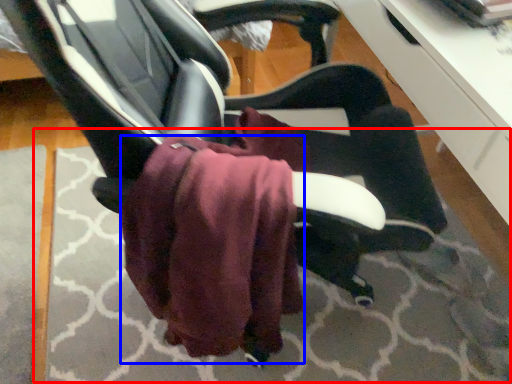
Question: Which object is further to the camera taking this photo, mat (highlighted by a red box) or bath towel (highlighted by a blue box)?

Choices:
 (A) mat
 (B) bath towel

Answer: (A)